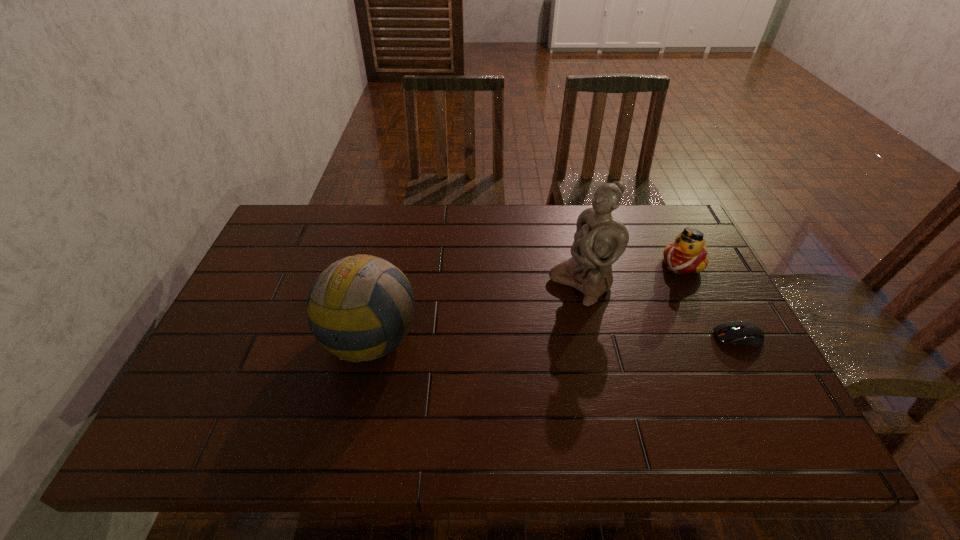
At what (x,y) coordinates should I click in order to perform the action: click on vacant space that satisfies the following two spatial constraints: 1. on the front side of the computer equipment; 2. on the button of the tallest object. Please return your answer as a coordinate pair (x, y). The image size is (960, 540). Looking at the image, I should click on (593, 337).

Find the location of a particular element. free spot that satisfies the following two spatial constraints: 1. on the front side of the shortest object; 2. on the button of the second object from left to right is located at coordinates (593, 337).

The width and height of the screenshot is (960, 540). In order to click on free region that satisfies the following two spatial constraints: 1. on the front side of the tallest object; 2. on the button of the computer equipment in this screenshot , I will do `click(593, 337)`.

Where is `vacant position in the image that satisfies the following two spatial constraints: 1. on the back side of the leftmost object; 2. on the right side of the third tallest object`? This screenshot has width=960, height=540. vacant position in the image that satisfies the following two spatial constraints: 1. on the back side of the leftmost object; 2. on the right side of the third tallest object is located at coordinates click(384, 264).